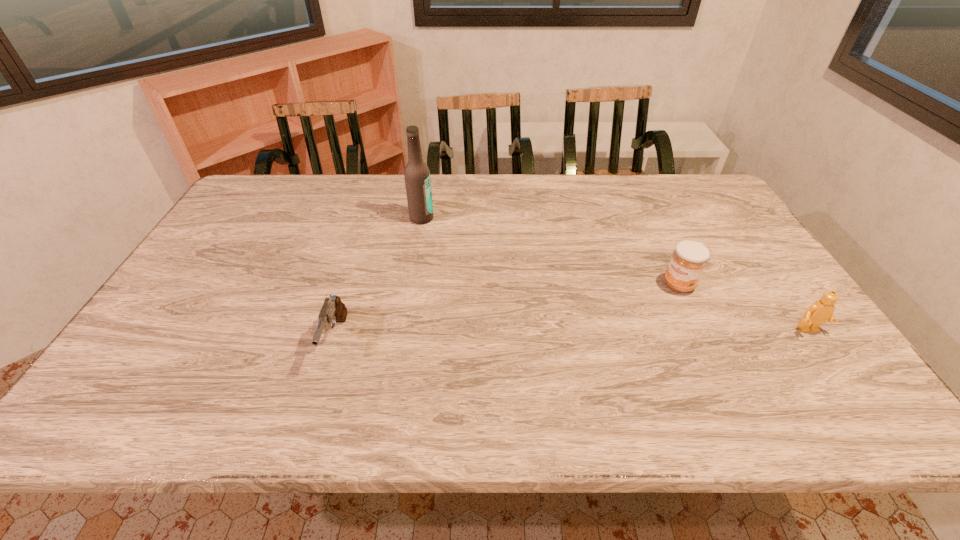
You are a GUI agent. You are given a task and a screenshot of the screen. Output one action in this format:
    pyautogui.click(x=<x>, y=<y>)
    Task: Click on the vacant space located on the label of the third object from right to left
    This screenshot has width=960, height=540.
    Given the screenshot: What is the action you would take?
    pyautogui.click(x=446, y=234)

You are a GUI agent. You are given a task and a screenshot of the screen. Output one action in this format:
    pyautogui.click(x=<x>, y=<y>)
    Task: Click on the free spot located 0.300m on the label of the third object from right to left
    This screenshot has width=960, height=540.
    Given the screenshot: What is the action you would take?
    point(498,267)

Identify the location of vacant region located on the label of the third object from right to left. This screenshot has height=540, width=960. (500, 269).

Image resolution: width=960 pixels, height=540 pixels. In order to click on object present at the far edge in this screenshot , I will do `click(416, 173)`.

You are a GUI agent. You are given a task and a screenshot of the screen. Output one action in this format:
    pyautogui.click(x=<x>, y=<y>)
    Task: Click on the object that is at the near edge
    The height and width of the screenshot is (540, 960).
    Given the screenshot: What is the action you would take?
    pyautogui.click(x=333, y=310)

You are a GUI agent. You are given a task and a screenshot of the screen. Output one action in this format:
    pyautogui.click(x=<x>, y=<y>)
    Task: Click on the object that is at the right edge
    
    Given the screenshot: What is the action you would take?
    pyautogui.click(x=820, y=311)

In the image, there is a desktop. At what (x,y) coordinates should I click in order to perform the action: click on vacant space at the far edge. Please return your answer as a coordinate pair (x, y). This screenshot has height=540, width=960. Looking at the image, I should click on (633, 182).

In the image, there is a desktop. Where is `vacant area at the near edge`? vacant area at the near edge is located at coordinates (575, 360).

This screenshot has width=960, height=540. I want to click on free space at the left edge, so click(175, 319).

The height and width of the screenshot is (540, 960). In order to click on free space at the right edge of the desktop in this screenshot , I will do `click(712, 259)`.